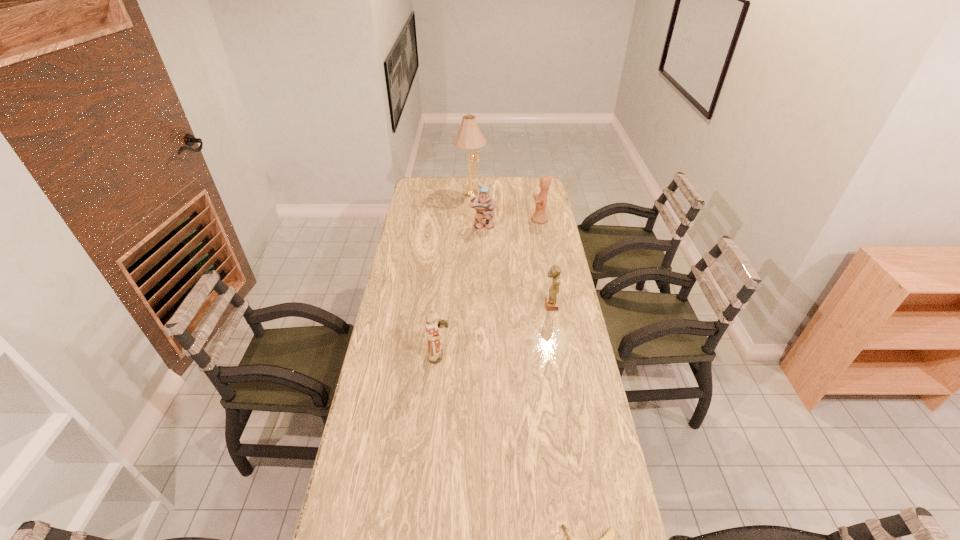
This screenshot has width=960, height=540. Find the location of `free space located on the front-facing side of the third farthest figurine`. free space located on the front-facing side of the third farthest figurine is located at coordinates (521, 305).

The width and height of the screenshot is (960, 540). I want to click on vacant region located 0.340m on the front-facing side of the third farthest figurine, so click(460, 305).

The image size is (960, 540). Identify the location of object that is at the far edge. (469, 136).

In the image, there is a desktop. At what (x,y) coordinates should I click in order to perform the action: click on vacant area at the far edge. Please return your answer as a coordinate pair (x, y). Image resolution: width=960 pixels, height=540 pixels. Looking at the image, I should click on [x=488, y=184].

Where is `free space at the left edge of the desktop`? The height and width of the screenshot is (540, 960). free space at the left edge of the desktop is located at coordinates (411, 201).

You are a GUI agent. You are given a task and a screenshot of the screen. Output one action in this format:
    pyautogui.click(x=<x>, y=<y>)
    Task: Click on the free space at the right edge of the desktop
    
    Given the screenshot: What is the action you would take?
    pyautogui.click(x=533, y=253)

Find the location of a particular element. vacant space at the far left corner of the desktop is located at coordinates (431, 179).

Locate an element on the screen. vacant space at the far right corner of the desktop is located at coordinates (526, 180).

You are a GUI agent. You are given a task and a screenshot of the screen. Output one action in this format:
    pyautogui.click(x=<x>, y=<y>)
    Task: Click on the free space between the fifth farthest object and the farthest object
    The image size is (960, 540).
    Given the screenshot: What is the action you would take?
    pyautogui.click(x=455, y=274)

Identify which object is located as the nearest to the third figurine from right to left. Please provide its 2D coordinates. Your answer should be formatted as a tuple, i.e. [(x, y)], where the tuple contains the x and y coordinates of a point satisfying the conditions above.

[(539, 216)]